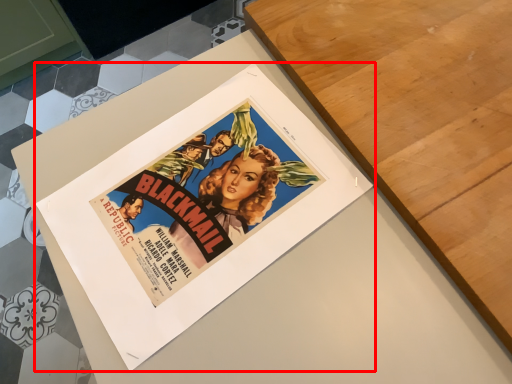
Question: Considering the relative positions of poster (annotated by the red box) and table in the image provided, where is poster (annotated by the red box) located with respect to the staircase?

Choices:
 (A) right
 (B) left

Answer: (A)